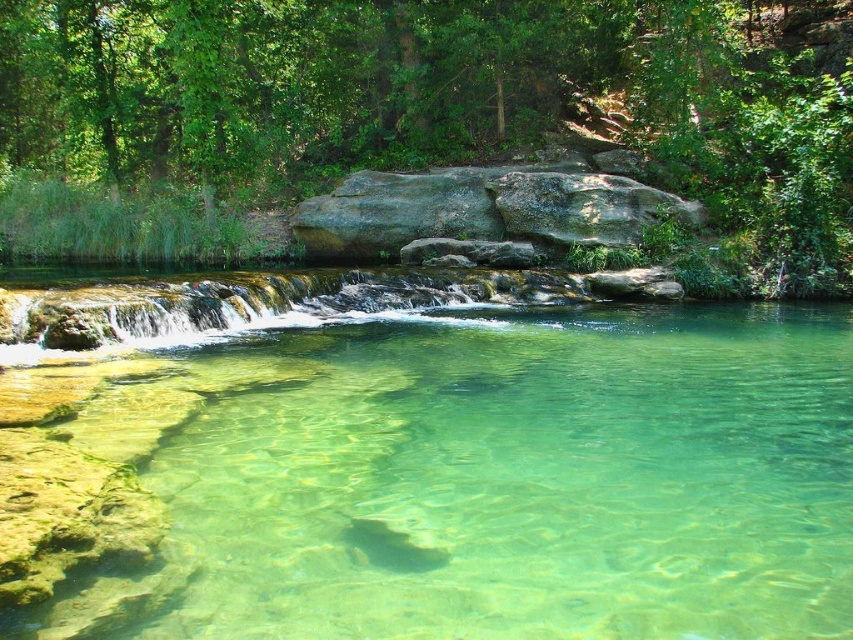
You are standing at the edge of the forest and looking at the serene natural scene described. There is a point marked at coordinates (x=430, y=468). Based on the description, what does this point most likely represent in the image?

The point at coordinates (x=430, y=468) corresponds to the clear glassy stream at center, as stated in the Objects Description.

You are standing in the forest scene and want to place a small marker at both the point labeled point (700, 449) and point (381, 60). Which point will require you to walk further back to reach?

Point (381, 60) will require you to walk further back because it is farther from the camera compared to point (700, 449).

You are planning to cross the stream using a 3 meter wide bridge. Given the clear glassy stream at center and the green leafy tree at upper center in the scene, can the bridge fit over the stream without touching the tree?

The clear glassy stream at center is narrower than the green leafy tree at upper center. Since the bridge is 3 meters wide, it can fit over the stream as the stream is narrower than the tree, but you need to ensure the bridge placement avoids the tree.